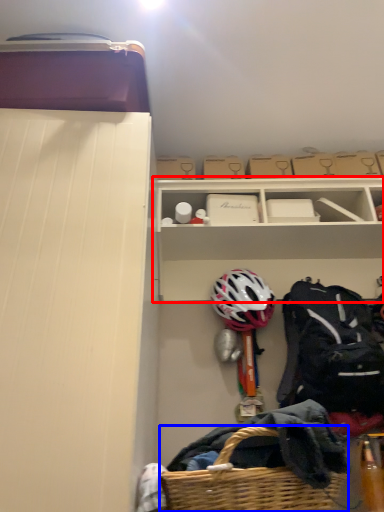
Question: Which point is further to the camera, shelf (highlighted by a red box) or picnic basket (highlighted by a blue box)?

Choices:
 (A) shelf
 (B) picnic basket

Answer: (A)